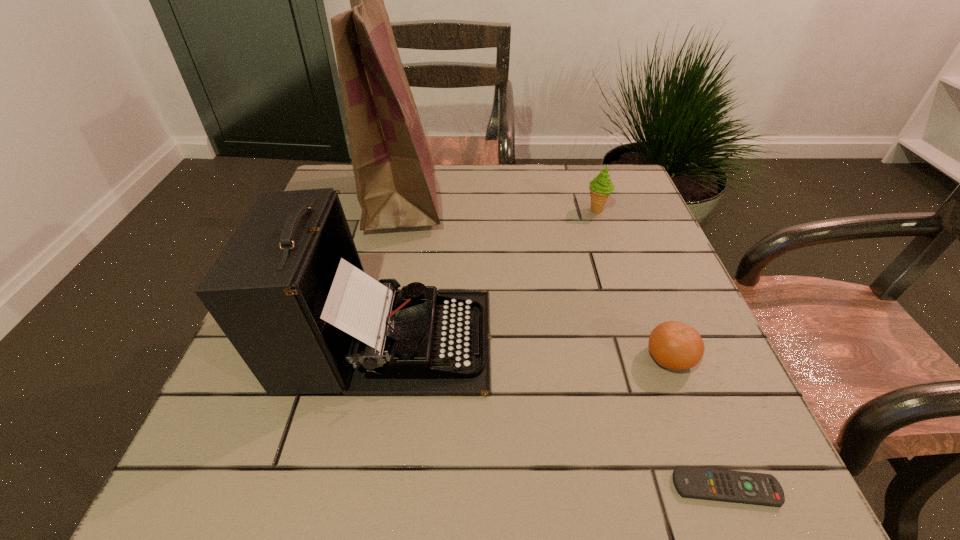
Where is `free space located 0.130m on the back of the nearest object`? This screenshot has width=960, height=540. free space located 0.130m on the back of the nearest object is located at coordinates (689, 394).

This screenshot has width=960, height=540. Identify the location of grocery bag at the far edge. (394, 173).

This screenshot has width=960, height=540. In order to click on icecream that is at the far edge in this screenshot , I will do `click(601, 187)`.

The image size is (960, 540). In order to click on object that is positioned at the near edge in this screenshot , I will do `click(690, 482)`.

The height and width of the screenshot is (540, 960). What are the coordinates of `grocery bag located in the left edge section of the desktop` in the screenshot? It's located at (394, 173).

Locate an element on the screen. typewriter present at the left edge is located at coordinates (289, 291).

Identify the location of icecream situated at the right edge. This screenshot has height=540, width=960. (601, 187).

This screenshot has height=540, width=960. Find the location of `clementine located in the right edge section of the desktop`. clementine located in the right edge section of the desktop is located at coordinates (674, 345).

This screenshot has height=540, width=960. I want to click on remote control located at the right edge, so click(690, 482).

I want to click on object situated at the far left corner, so pyautogui.click(x=394, y=173).